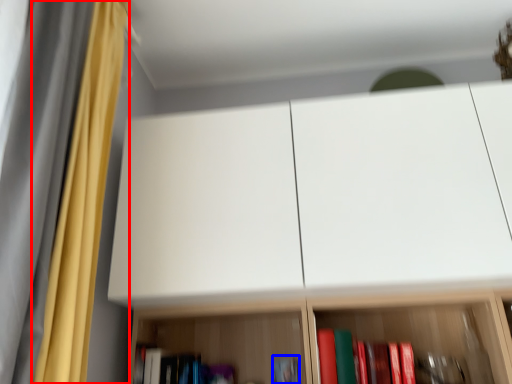
Question: Among these objects, which one is nearest to the camera, curtain (highlighted by a red box) or book (highlighted by a blue box)?

Choices:
 (A) curtain
 (B) book

Answer: (A)